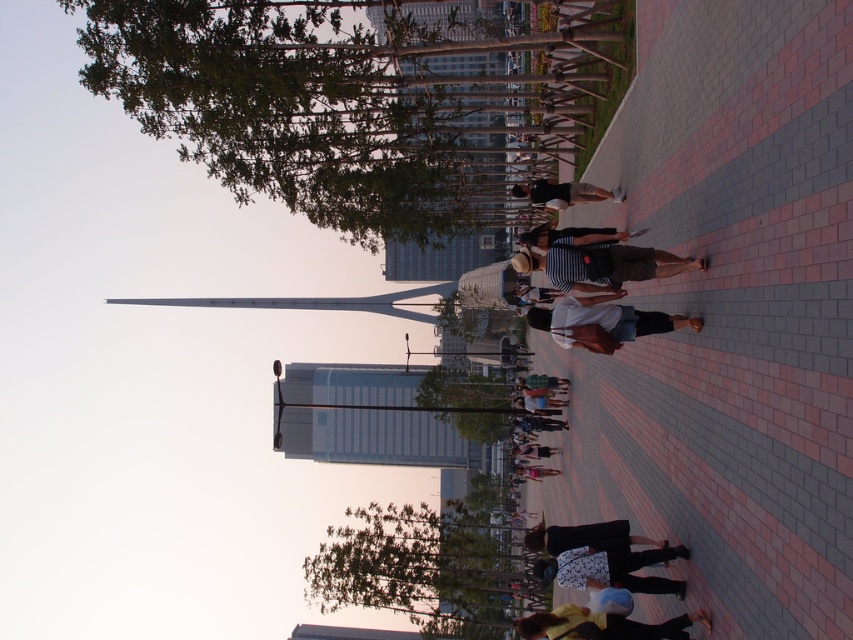
You are a photographer trying to capture both the striped cotton shirt at center and the white dotted shirt at center in the same frame. Since you want to emphasize the size difference between them, which shirt should you position closer to the camera to achieve this effect?

To emphasize the size difference between the striped cotton shirt at center and the white dotted shirt at center, you should position the striped cotton shirt at center closer to the camera. This is because the striped cotton shirt at center is wider than the white dotted shirt at center, so placing it nearer will make its size more pronounced in the photo.

You are standing on the paved walkway with alternating pink and gray bricks in the urban scene. You notice a point marked at coordinates (611, 568). What object is located at this coordinate?

The point at coordinates (611, 568) is located on the white dotted shirt at center.